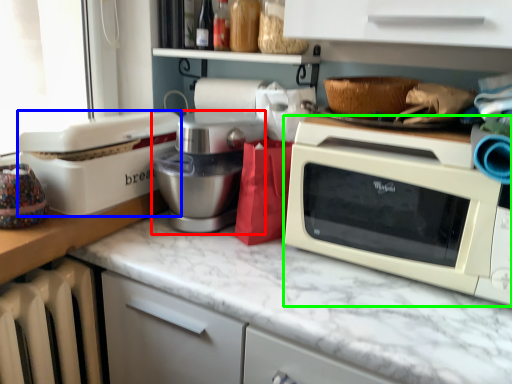
Question: Which object is the closest to the mixer (highlighted by a red box)? Choose among these: appliance (highlighted by a blue box) or microwave oven (highlighted by a green box).

Choices:
 (A) appliance
 (B) microwave oven

Answer: (A)